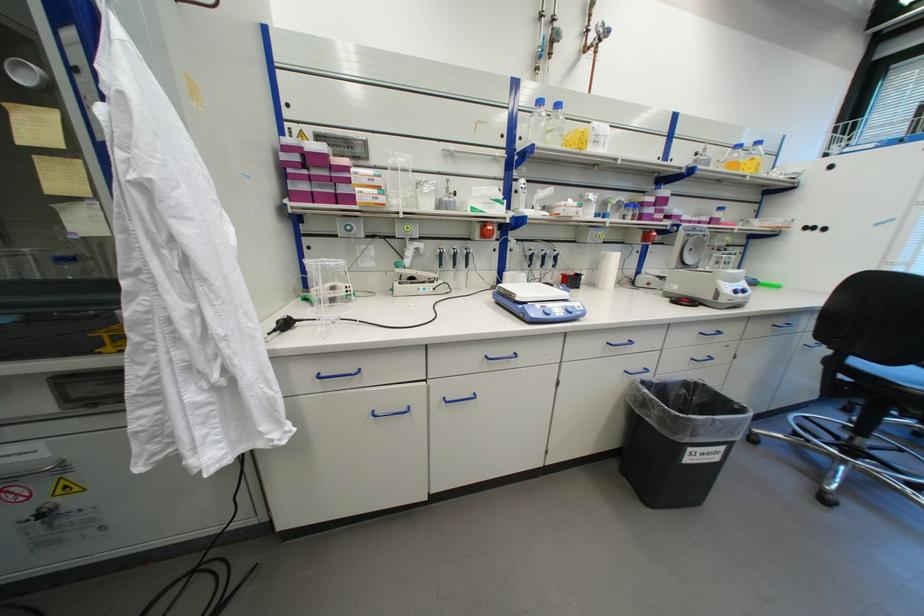
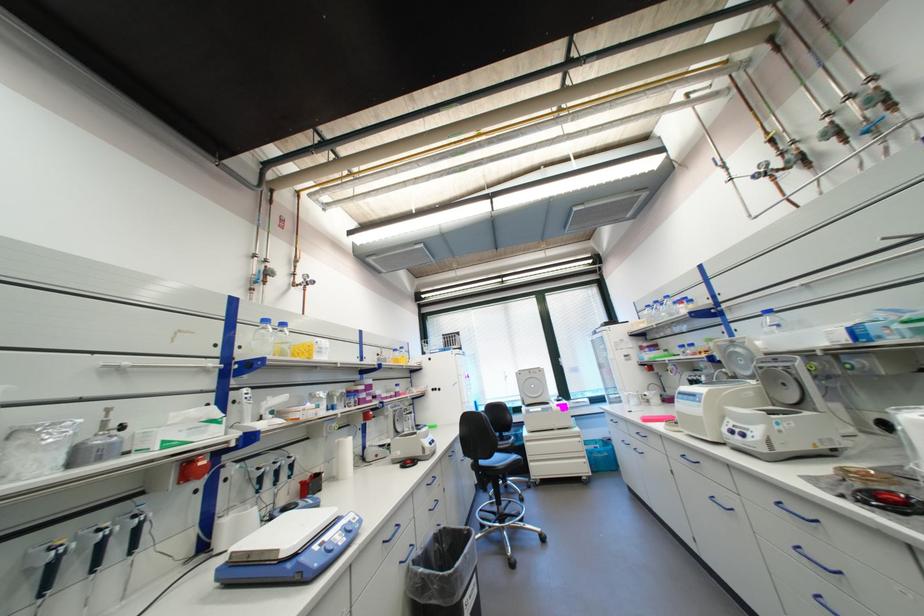
Locate, in the second image, the point that corresponds to the point at 556,105 in the first image.

(283, 323)